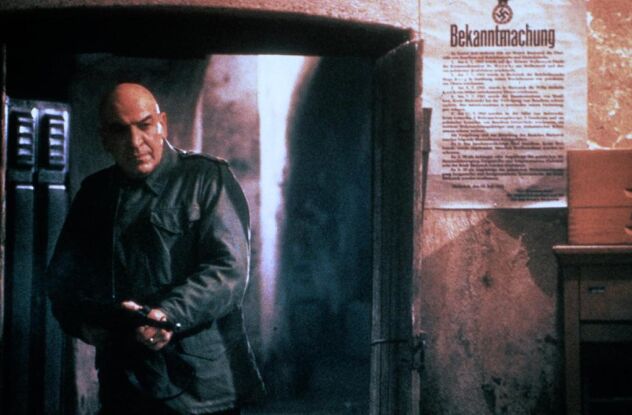
At what (x,y) coordinates should I click in order to perform the action: click on notice made of paper. Please return your answer as a coordinate pair (x, y). This screenshot has width=632, height=415. Looking at the image, I should click on (492, 66).